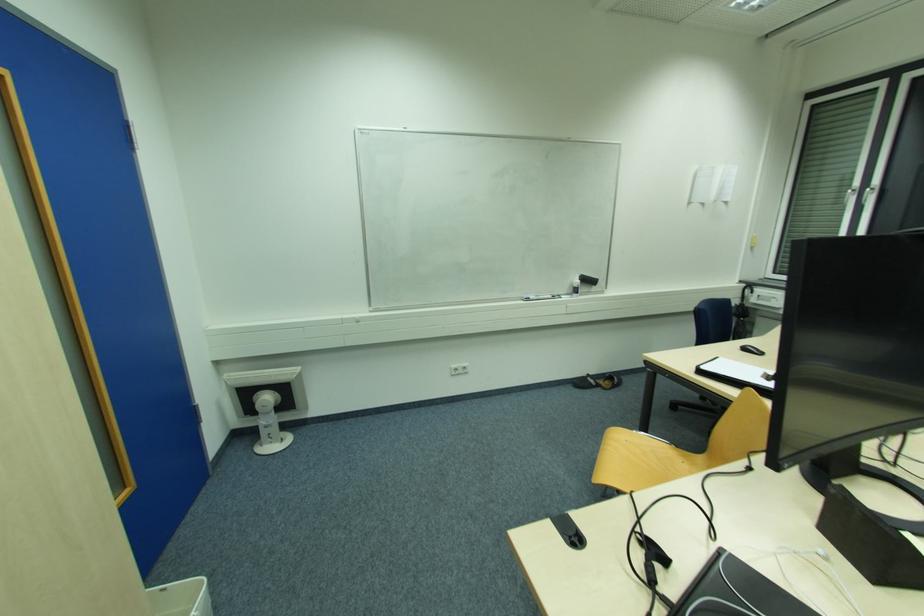
Where would you pull the white window handle? Please return your answer as a coordinate pair (x, y).

(849, 196)